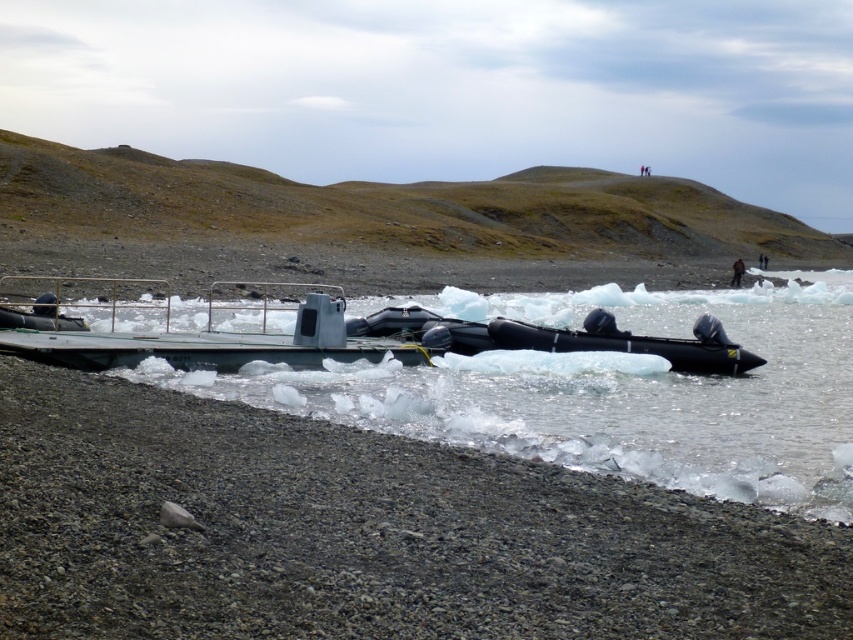
Who is positioned more to the left, black rubber boat at lower center or black rubber boat at center?

From the viewer's perspective, black rubber boat at center appears more on the left side.

Describe the element at coordinates (610, 390) in the screenshot. I see `black rubber boat at lower center` at that location.

What are the coordinates of `black rubber boat at lower center` in the screenshot? It's located at (610, 390).

Does gray gravel shore at lower left have a larger size compared to black rubber boat at lower center?

Incorrect, gray gravel shore at lower left is not larger than black rubber boat at lower center.

The width and height of the screenshot is (853, 640). Describe the element at coordinates (364, 532) in the screenshot. I see `gray gravel shore at lower left` at that location.

This screenshot has width=853, height=640. I want to click on gray gravel shore at lower left, so click(364, 532).

Does point (616, 316) come behind point (735, 284)?

No, it is not.

Can you confirm if black rubber boat at lower center is positioned to the right of brown fuzzy jacket at upper right?

Result: No, black rubber boat at lower center is not to the right of brown fuzzy jacket at upper right.

Which is in front, point (636, 396) or point (740, 260)?

Positioned in front is point (636, 396).

Where is `black rubber boat at lower center`? This screenshot has width=853, height=640. black rubber boat at lower center is located at coordinates (610, 390).